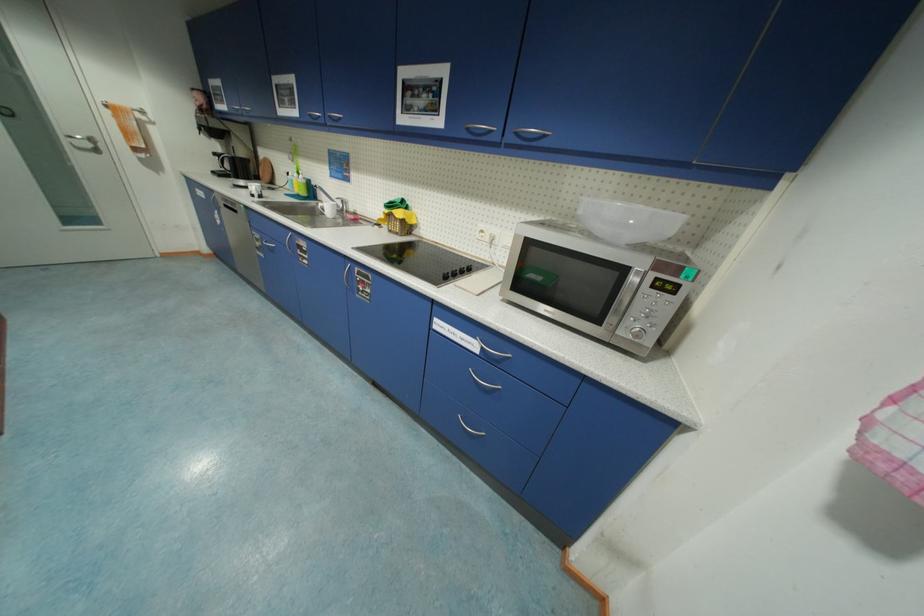
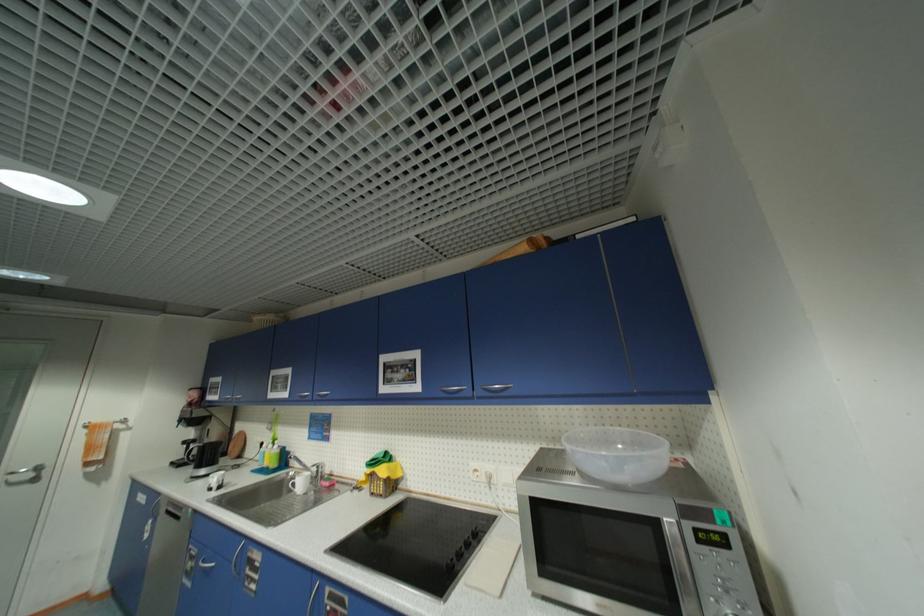
Where in the second image is the point corresponding to [323,205] from the first image?

(294, 475)